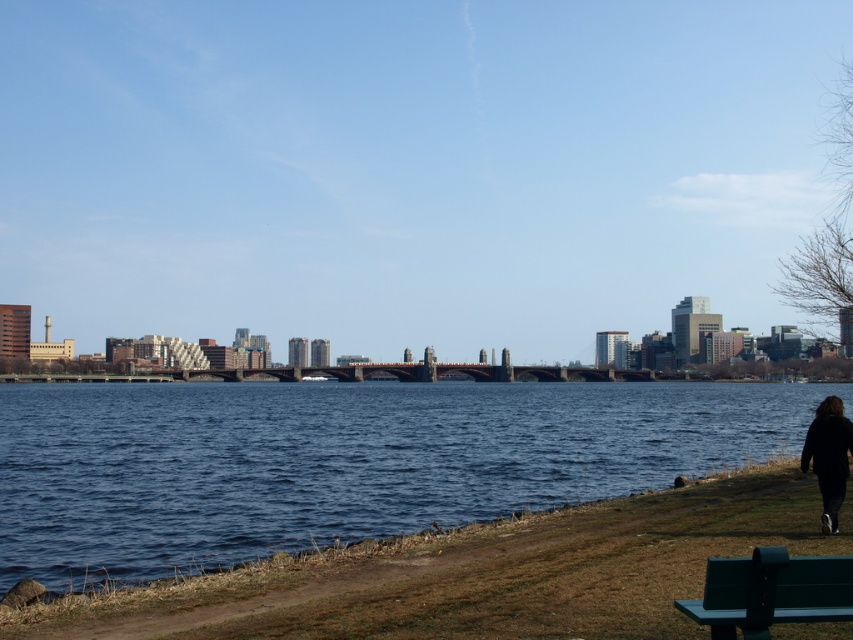
Which is behind, point (743, 586) or point (822, 445)?

Point (822, 445)

Is green painted wood park bench at lower right shorter than black fabric jacket at lower right?

Yes, green painted wood park bench at lower right is shorter than black fabric jacket at lower right.

Between point (705, 576) and point (824, 477), which one is positioned behind?

The point (824, 477) is more distant.

Locate an element on the screen. The height and width of the screenshot is (640, 853). green painted wood park bench at lower right is located at coordinates (770, 593).

Between point (302, 500) and point (822, 435), which one is positioned behind?

The point (302, 500) is more distant.

Which is in front, point (45, 401) or point (817, 483)?

Point (817, 483) is more forward.

Between point (22, 516) and point (833, 490), which one is positioned in front?

Point (833, 490) is in front.

Locate an element on the screen. The height and width of the screenshot is (640, 853). blue water at center is located at coordinates (341, 460).

Who is more forward, (138, 518) or (753, 584)?

Positioned in front is point (753, 584).

Can you confirm if blue water at center is taller than green painted wood park bench at lower right?

Yes.

Who is more forward, (x=125, y=547) or (x=693, y=602)?

Point (x=693, y=602) is more forward.

Find the location of a particular element. This screenshot has height=640, width=853. blue water at center is located at coordinates (341, 460).